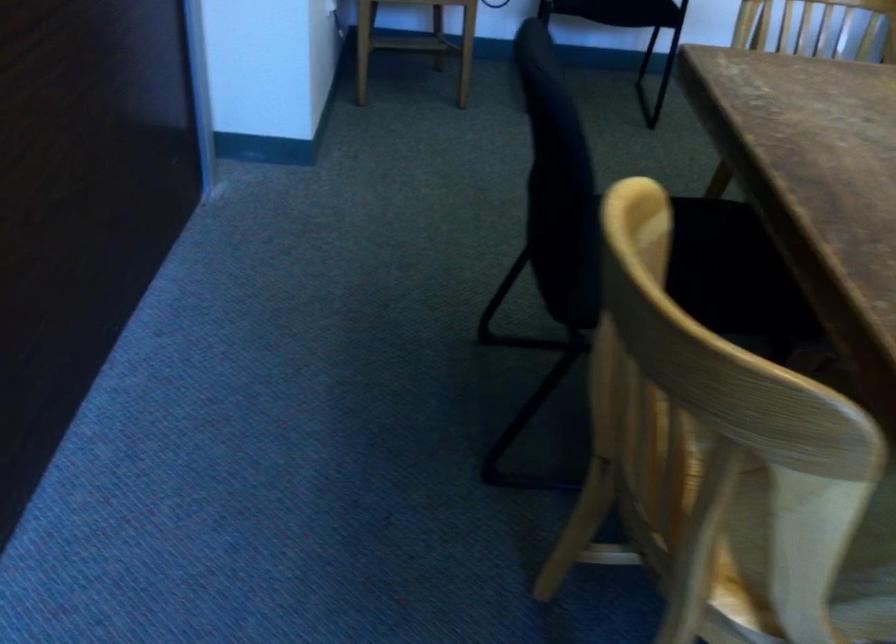
The width and height of the screenshot is (896, 644). Describe the element at coordinates (872, 538) in the screenshot. I see `a wooden chair armrest` at that location.